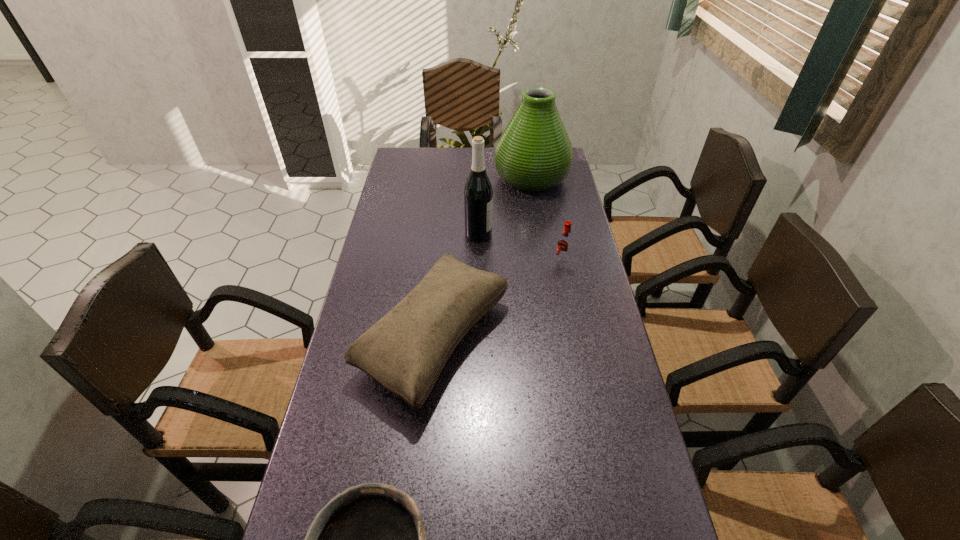
At what (x,y) coordinates should I click in order to perform the action: click on free space in the image that satisfies the following two spatial constraints: 1. on the label of the wine bottle; 2. on the front side of the second nearest object. Please return your answer as a coordinate pair (x, y). This screenshot has height=540, width=960. Looking at the image, I should click on (478, 339).

You are a GUI agent. You are given a task and a screenshot of the screen. Output one action in this format:
    pyautogui.click(x=<x>, y=<y>)
    Task: Click on the free space that satisfies the following two spatial constraints: 1. on the front side of the root beer; 2. on the left side of the farthest object
    
    Given the screenshot: What is the action you would take?
    pyautogui.click(x=545, y=263)